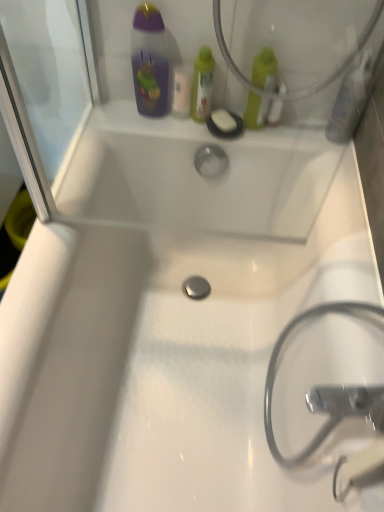
The image size is (384, 512). I want to click on vacant area that is situated to the right of translucent plastic mouthwash at upper right, which appears as the 2th mouthwash when viewed from the right, so click(x=317, y=136).